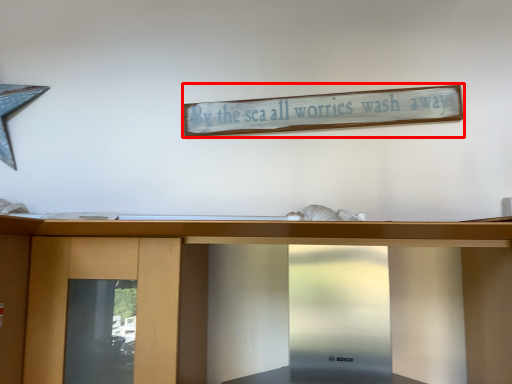
Question: In this image, where is bulletin board (annotated by the red box) located relative to furniture?

Choices:
 (A) right
 (B) left

Answer: (A)